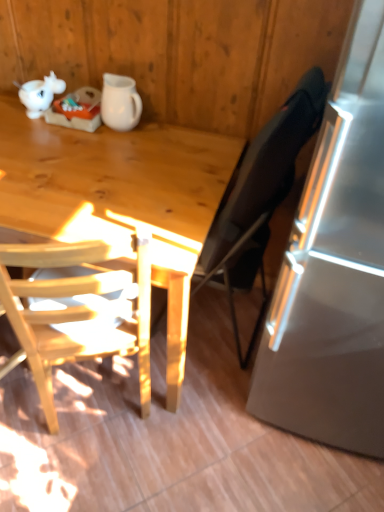
What are the coordinates of `vacant area that is in front of white matte pitcher at upper center` in the screenshot? It's located at (110, 143).